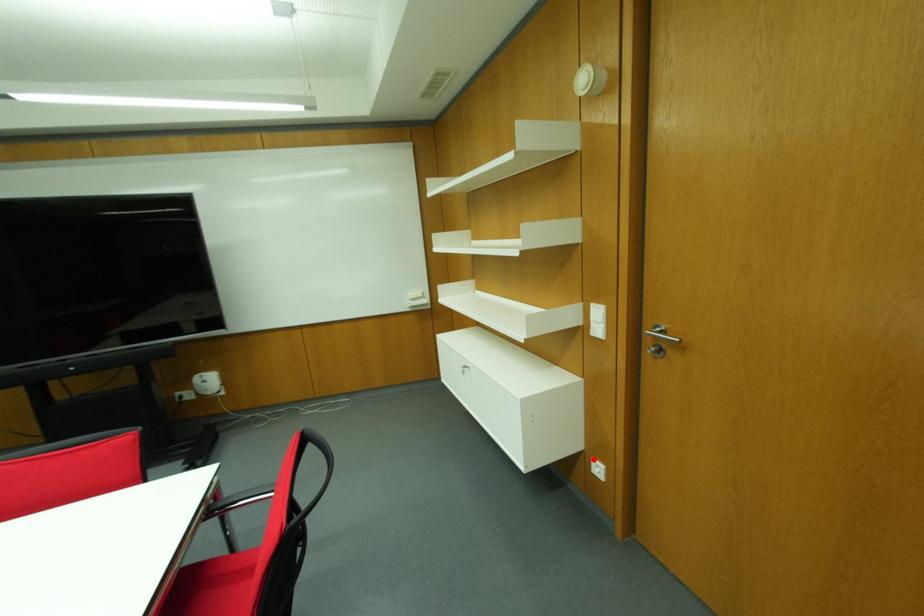
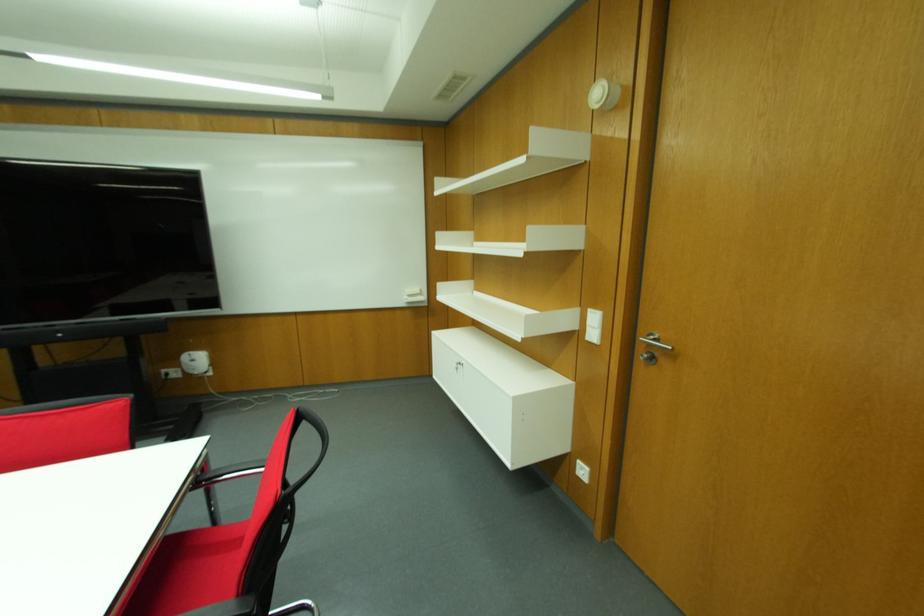
Question: I am providing you with two images of the same scene from different viewpoints. A red point is shown in image1. For the corresponding object point in image2, is it positioned nearer or farther from the camera?

Choices:
 (A) Nearer
 (B) Farther

Answer: (B)